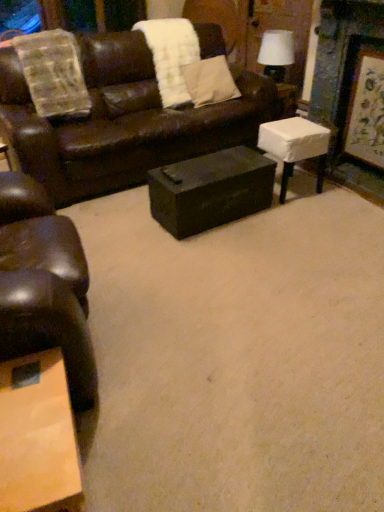
This screenshot has width=384, height=512. Find the location of `free area in between shiny brown leather chair at left and white fabric-covered stool at right, the second table in the left-to-right sequence`. free area in between shiny brown leather chair at left and white fabric-covered stool at right, the second table in the left-to-right sequence is located at coordinates (183, 273).